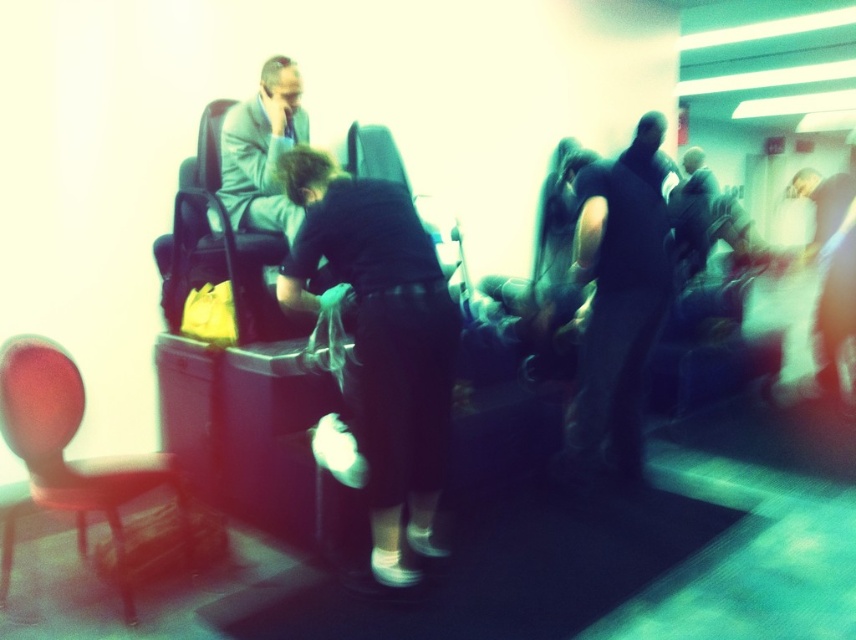
Is dark fabric shirt at center above matte black chair at upper left?

No.

Does dark fabric shirt at center have a lesser width compared to matte black chair at upper left?

Incorrect, dark fabric shirt at center's width is not less than matte black chair at upper left's.

You are a GUI agent. You are given a task and a screenshot of the screen. Output one action in this format:
    pyautogui.click(x=<x>, y=<y>)
    Task: Click on the dark fabric shirt at center
    The width and height of the screenshot is (856, 640).
    Given the screenshot: What is the action you would take?
    click(382, 340)

Between matte red chair at left and matte black chair at center, which one has more height?

matte red chair at left

Does matte red chair at left have a smaller size compared to matte black chair at center?

Incorrect, matte red chair at left is not smaller in size than matte black chair at center.

Which is in front, point (116, 492) or point (379, 177)?

Point (116, 492) is in front.

This screenshot has width=856, height=640. Identify the location of matte red chair at left. [x=67, y=444].

Does matte black chair at upper left have a greater width compared to matte black chair at center?

Yes, matte black chair at upper left is wider than matte black chair at center.

Looking at this image, between matte black chair at upper left and matte black chair at center, which one has more height?

matte black chair at upper left is taller.

Does point (191, 273) lie in front of point (384, 125)?

Yes, point (191, 273) is closer to viewer.

Image resolution: width=856 pixels, height=640 pixels. I want to click on matte black chair at upper left, so click(218, 244).